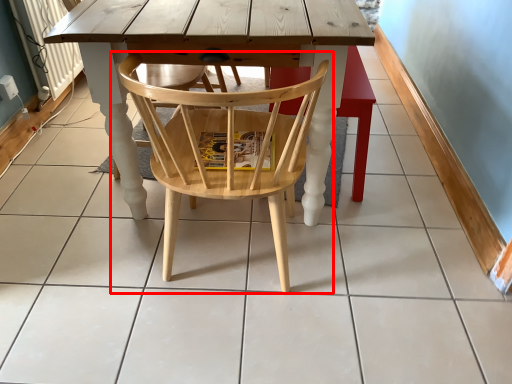
Question: Observing the image, what is the correct spatial positioning of chair (annotated by the red box) in reference to bar stool?

Choices:
 (A) left
 (B) right

Answer: (A)